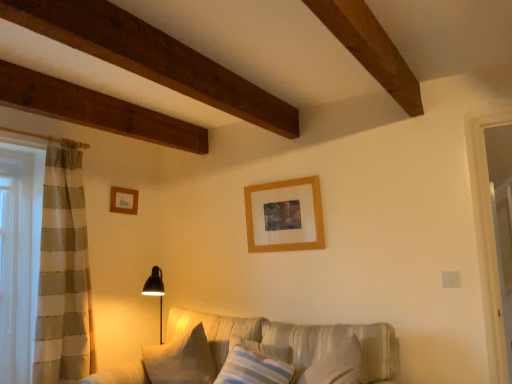
Question: Is textured beige couch at center bigger or smaller than white soft pillow at lower center, placed as the first pillow when sorted from left to right?

Choices:
 (A) small
 (B) big

Answer: (B)

Question: Is textured beige couch at center spatially inside white soft pillow at lower center, placed as the first pillow when sorted from left to right, or outside of it?

Choices:
 (A) inside
 (B) outside

Answer: (B)

Question: Which object is positioned closest to the striped fabric pillow at center, the second pillow in the left-to-right sequence?

Choices:
 (A) wooden picture frame at upper center, which is the 2th picture frame in back-to-front order
 (B) wooden picture frame at upper left, which ranks as the first picture frame in back-to-front order
 (C) textured beige couch at center
 (D) white soft pillow at lower center, which is the 2th pillow from right to left

Answer: (C)

Question: Considering the real-world distances, which object is closest to the wooden picture frame at upper center, the 1th picture frame when ordered from right to left?

Choices:
 (A) textured beige couch at center
 (B) wooden picture frame at upper left, the second picture frame when ordered from right to left
 (C) white soft pillow at lower center, placed as the first pillow when sorted from left to right
 (D) striped fabric pillow at center, which is the 1th pillow in right-to-left order

Answer: (A)